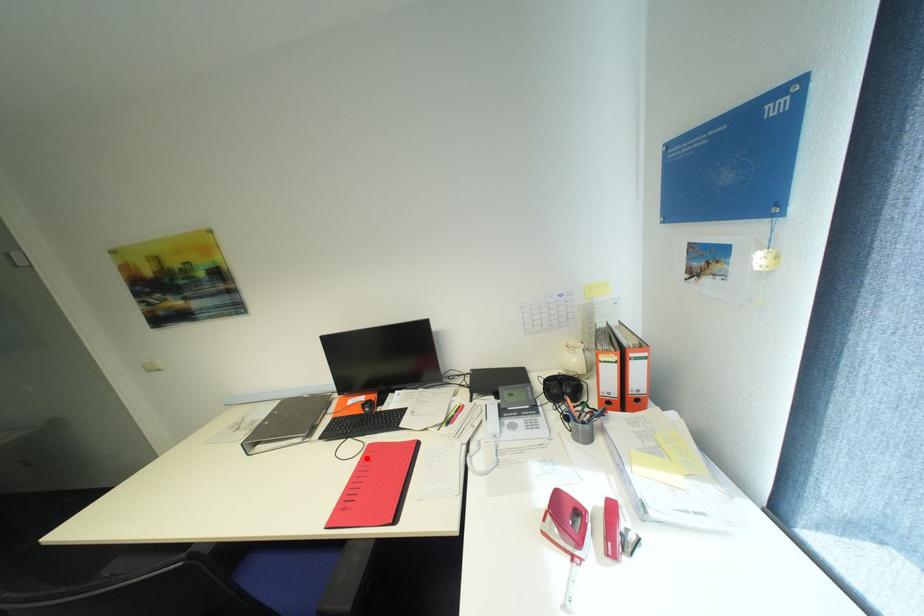
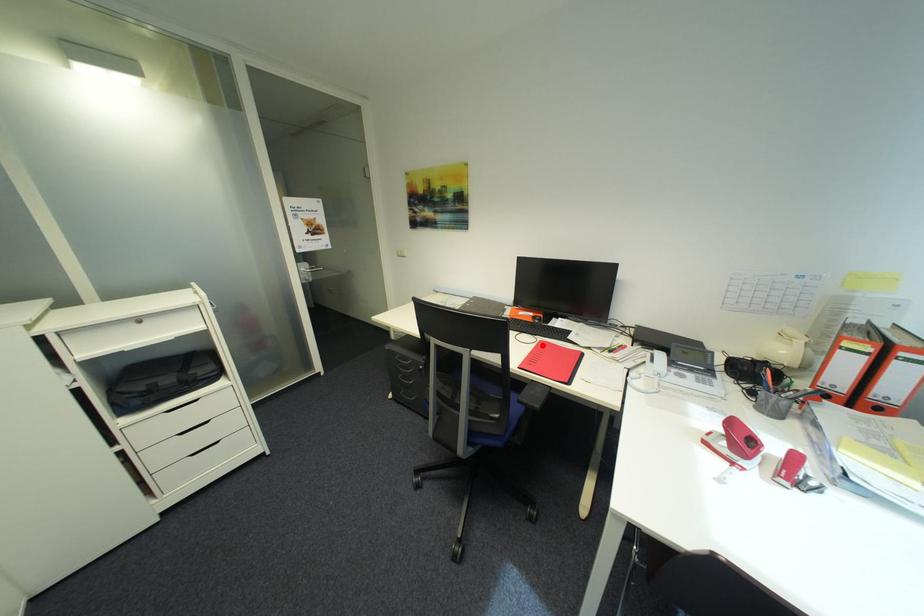
I am providing you with two images of the same scene from different viewpoints. A red point is marked on the first image and another point is marked on the second image. Is the red point in image1 aligned with the point shown in image2?

Yes